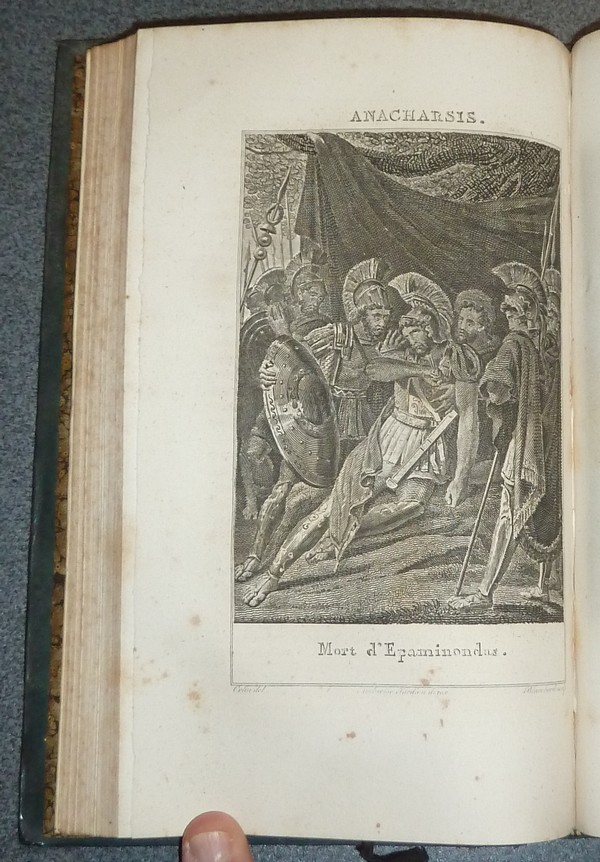
Identify the location of book. (149, 82).